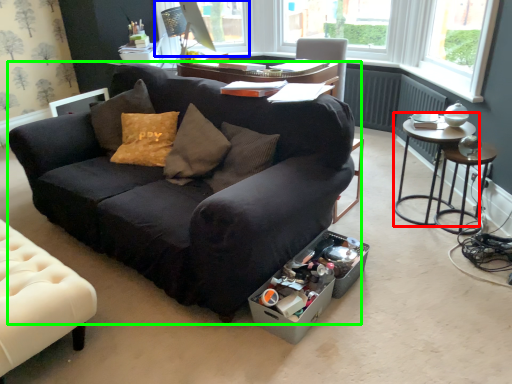
Question: Based on their relative distances, which object is farther from table (highlighted by a red box)? Choose from window screen (highlighted by a blue box) and studio couch (highlighted by a green box).

Choices:
 (A) window screen
 (B) studio couch

Answer: (A)